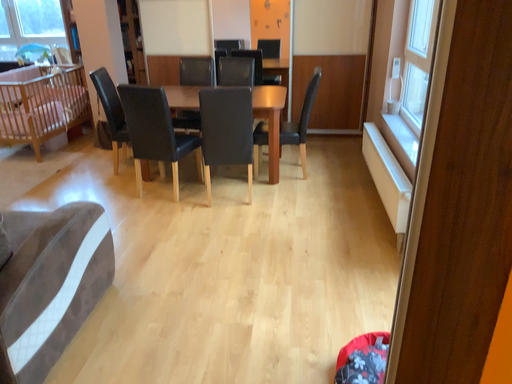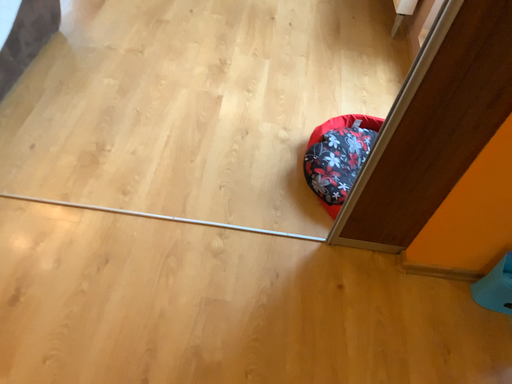
Question: Which way did the camera rotate in the video?

Choices:
 (A) rotated upward
 (B) rotated downward

Answer: (B)